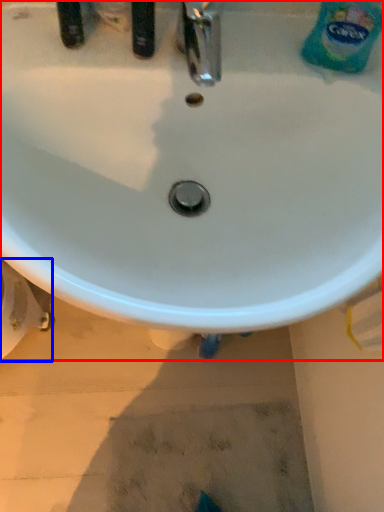
Question: Which object is closer to the camera taking this photo, sink (highlighted by a red box) or bidet (highlighted by a blue box)?

Choices:
 (A) sink
 (B) bidet

Answer: (A)